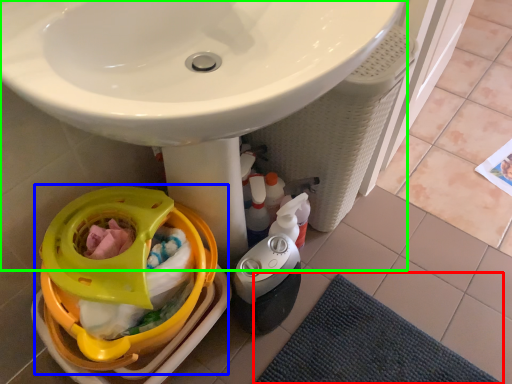
Question: Which object is positioned closest to bath mat (highlighted by a red box)? Select from baby carriage (highlighted by a blue box) and sink (highlighted by a green box).

Choices:
 (A) baby carriage
 (B) sink

Answer: (A)